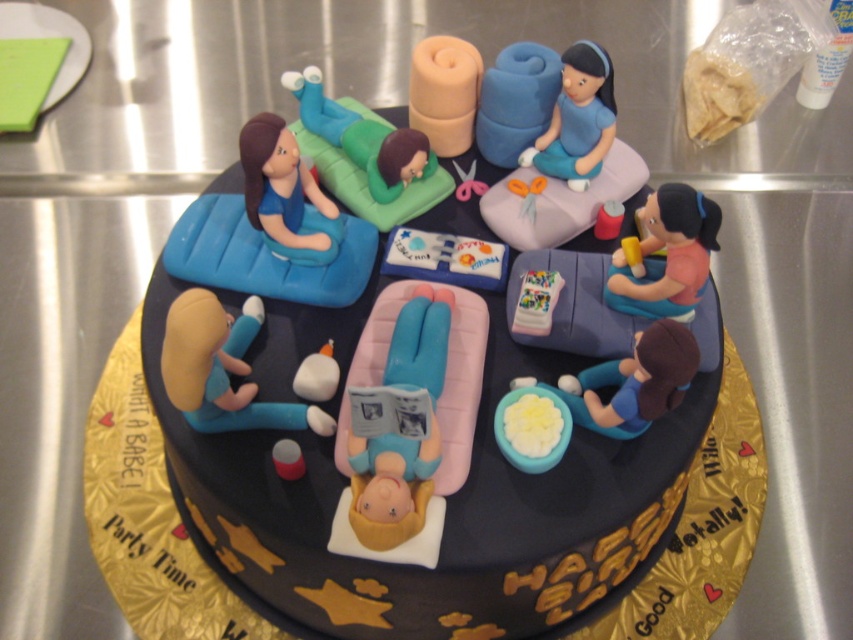
Can you confirm if blue glossy bowl at lower right is smaller than matte pink fabric at center?

No, blue glossy bowl at lower right is not smaller than matte pink fabric at center.

Which of these two, blue glossy bowl at lower right or matte pink fabric at center, stands taller?

Standing taller between the two is blue glossy bowl at lower right.

The height and width of the screenshot is (640, 853). What are the coordinates of `blue glossy bowl at lower right` in the screenshot? It's located at (630, 381).

From the picture: Is blue glossy bowl at lower right further to camera compared to matte green fabric at upper center?

That is False.

Can you confirm if blue glossy bowl at lower right is bigger than matte green fabric at upper center?

No.

Which is behind, point (653, 387) or point (421, 136)?

The point (421, 136) is behind.

Locate an element on the screen. blue glossy bowl at lower right is located at coordinates (630, 381).

Does point (329, 630) lie behind point (312, 234)?

Yes, it is behind point (312, 234).

Between matte blue cake at center and matte blue figure at upper left, which one is positioned lower?

Positioned lower is matte blue cake at center.

Measure the distance between matte blue cake at center and camera.

matte blue cake at center is 28.98 inches from camera.

Identify the location of matte blue cake at center. This screenshot has height=640, width=853. (422, 474).